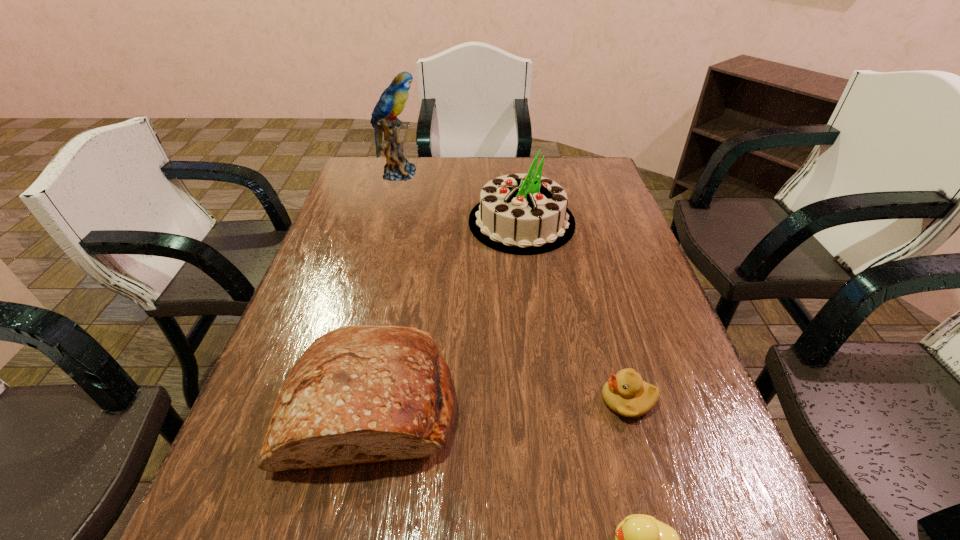
Where is `vacant region located on the front-facing side of the farther duckling`? vacant region located on the front-facing side of the farther duckling is located at coordinates [x=477, y=400].

Where is `object at the far edge`? This screenshot has width=960, height=540. object at the far edge is located at coordinates (392, 101).

At what (x,y) coordinates should I click in order to perform the action: click on parrot that is positioned at the left edge. Please return your answer as a coordinate pair (x, y). The width and height of the screenshot is (960, 540). Looking at the image, I should click on (392, 101).

Where is `bread that is at the left edge`? This screenshot has width=960, height=540. bread that is at the left edge is located at coordinates (359, 394).

Image resolution: width=960 pixels, height=540 pixels. Find the location of `object located at the right edge`. object located at the right edge is located at coordinates 625,393.

The image size is (960, 540). I want to click on object situated at the far left corner, so click(x=392, y=101).

I want to click on vacant space at the far edge of the desktop, so click(414, 163).

Identify the location of vacant space at the near edge. (450, 523).

At what (x,y) coordinates should I click in order to perform the action: click on vacant space at the left edge of the desktop. Please return your answer as a coordinate pair (x, y). This screenshot has height=540, width=960. Looking at the image, I should click on tap(347, 256).

The width and height of the screenshot is (960, 540). Find the location of `free space at the right edge of the desktop`. free space at the right edge of the desktop is located at coordinates (611, 237).